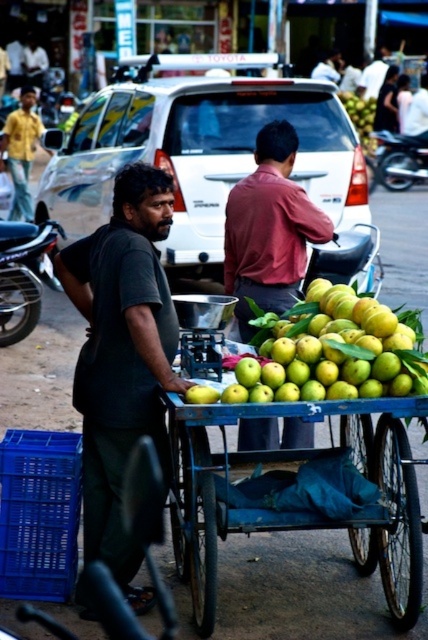
Is blue metallic cart at center smaller than green matte apples at center?

No.

Is blue metallic cart at center taller than green matte apples at center?

Yes, blue metallic cart at center is taller than green matte apples at center.

Image resolution: width=428 pixels, height=640 pixels. In order to click on blue metallic cart at center in this screenshot , I will do `click(296, 509)`.

Who is taller, dark gray shirt at left or green matte apples at center?

With more height is dark gray shirt at left.

Does point (115, 298) lie in front of point (380, 365)?

No, it is behind (380, 365).

Does point (142, 230) lie in front of point (276, 371)?

No, it is not.

At what (x,y) coordinates should I click in order to perform the action: click on dark gray shirt at left. Please return your answer as a coordinate pair (x, y). Image resolution: width=428 pixels, height=640 pixels. Looking at the image, I should click on (121, 356).

In the scene shown: How distant is dark gray shirt at left from blue metallic cart at center?

A distance of 23.88 inches exists between dark gray shirt at left and blue metallic cart at center.

Is point (149, 308) positioned in front of point (419, 403)?

No, (149, 308) is behind (419, 403).

Does point (65, 256) come closer to viewer compared to point (407, 468)?

No.

You are a GUI agent. You are given a task and a screenshot of the screen. Output one action in this format:
    pyautogui.click(x=<x>, y=<y>)
    Task: Click on the dark gray shirt at left
    
    Given the screenshot: What is the action you would take?
    pyautogui.click(x=121, y=356)